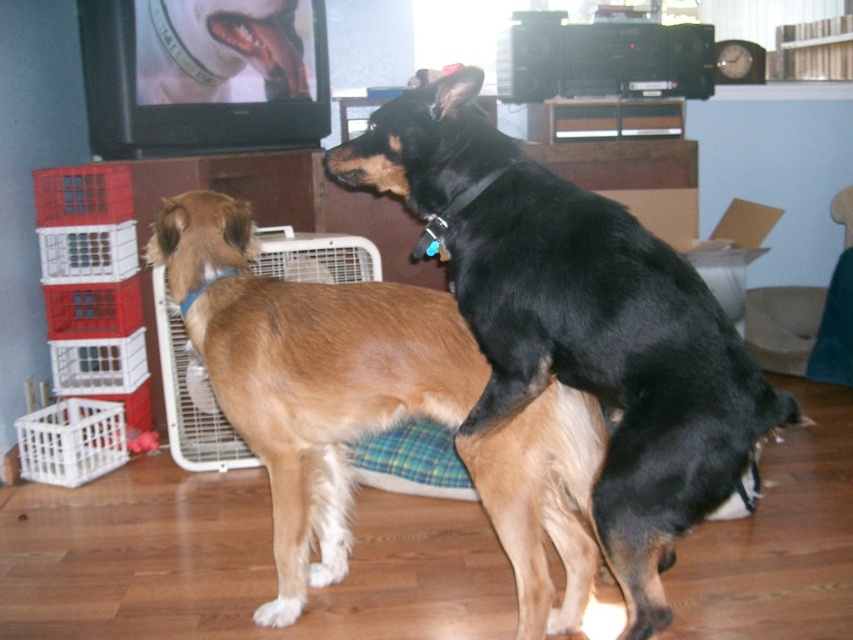
Question: Which point is closer to the camera taking this photo?

Choices:
 (A) click(x=473, y=280)
 (B) click(x=581, y=488)

Answer: (A)

Question: Among these objects, which one is farthest from the camera?

Choices:
 (A) black smooth dog at center
 (B) brown furry dog at center

Answer: (B)

Question: Is black smooth dog at center bigger than brown furry dog at center?

Choices:
 (A) no
 (B) yes

Answer: (A)

Question: Which object is farther from the camera taking this photo?

Choices:
 (A) brown furry dog at center
 (B) black smooth dog at center

Answer: (A)

Question: In this image, where is black smooth dog at center located relative to brown furry dog at center?

Choices:
 (A) left
 (B) right

Answer: (B)

Question: Considering the relative positions of black smooth dog at center and brown furry dog at center in the image provided, where is black smooth dog at center located with respect to brown furry dog at center?

Choices:
 (A) left
 (B) right

Answer: (B)